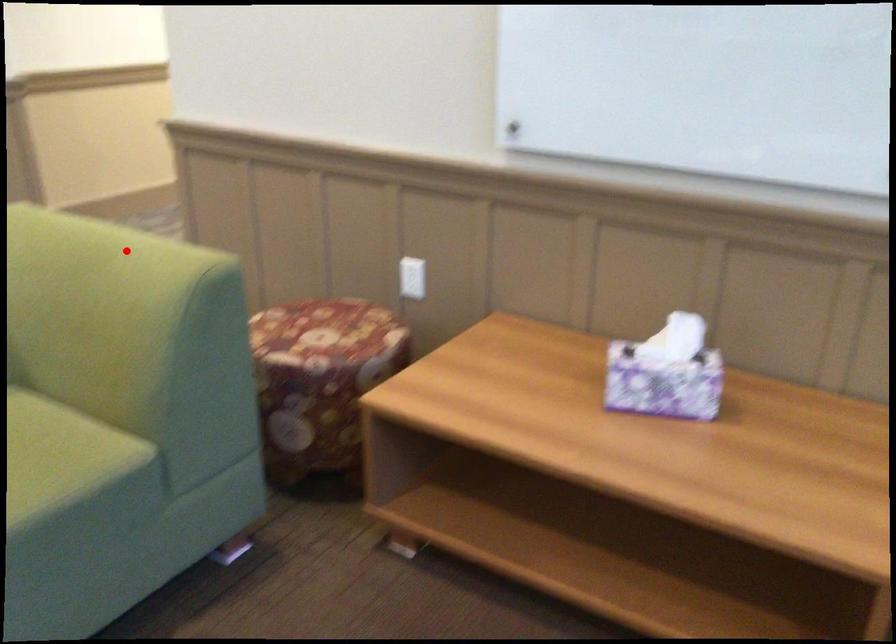
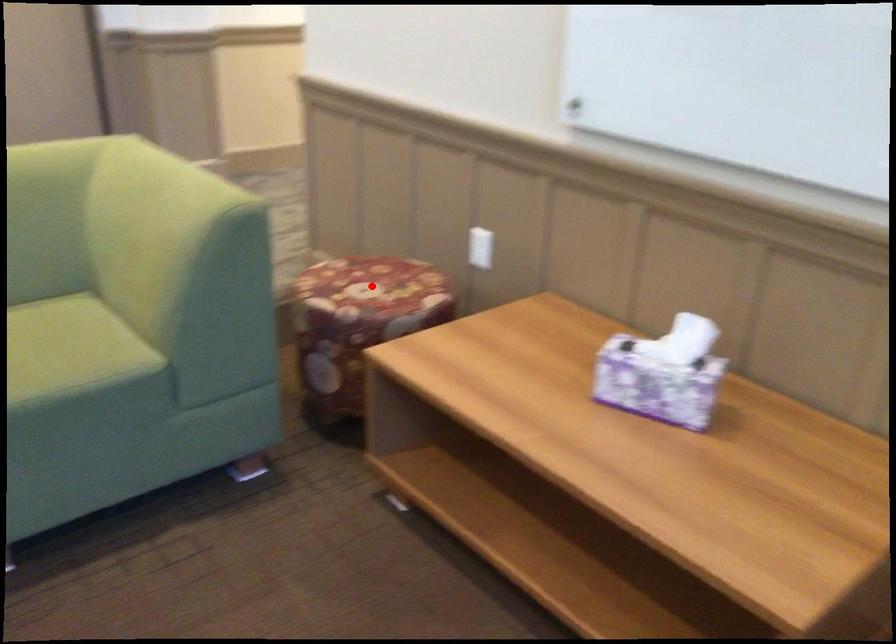
I am providing you with two images of the same scene from different viewpoints. A red point is marked on the first image and another point is marked on the second image. Is the marked point in image1 the same physical position as the marked point in image2?

No